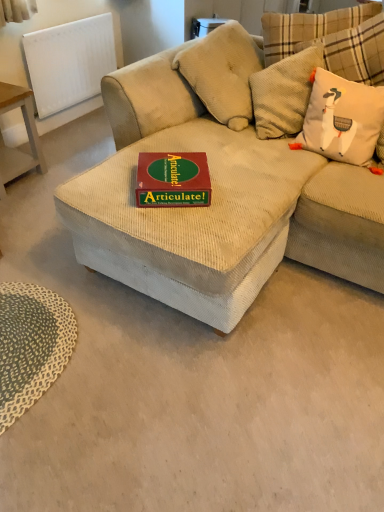
Where is `vacant space in between beige corduroy couch at center and green textured mat at lower left`? The height and width of the screenshot is (512, 384). vacant space in between beige corduroy couch at center and green textured mat at lower left is located at coordinates (164, 387).